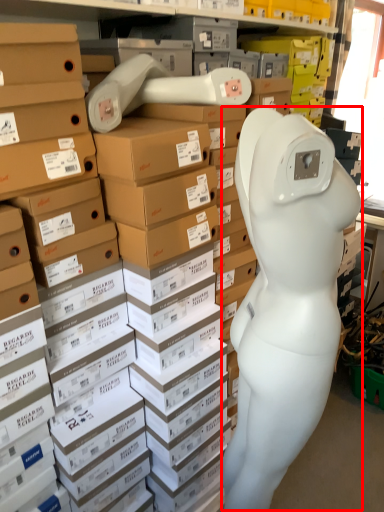
Question: From the image, what is the correct spatial relationship of worker (annotated by the red box) in relation to head?

Choices:
 (A) right
 (B) left

Answer: (B)